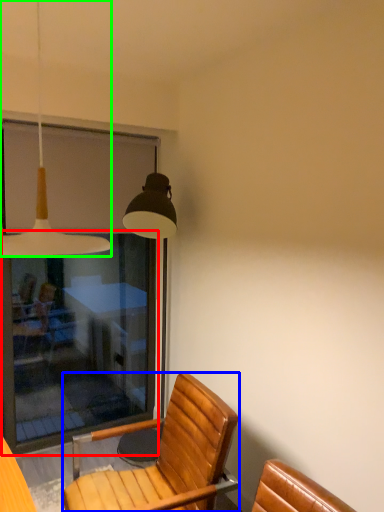
Question: Which object is positioned farthest from screen door (highlighted by a red box)? Select from chair (highlighted by a blue box) and lamp (highlighted by a green box).

Choices:
 (A) chair
 (B) lamp

Answer: (B)